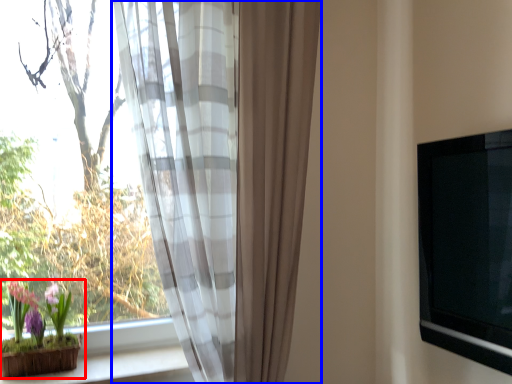
Question: Which object is further to the camera taking this photo, houseplant (highlighted by a red box) or curtain (highlighted by a blue box)?

Choices:
 (A) houseplant
 (B) curtain

Answer: (A)